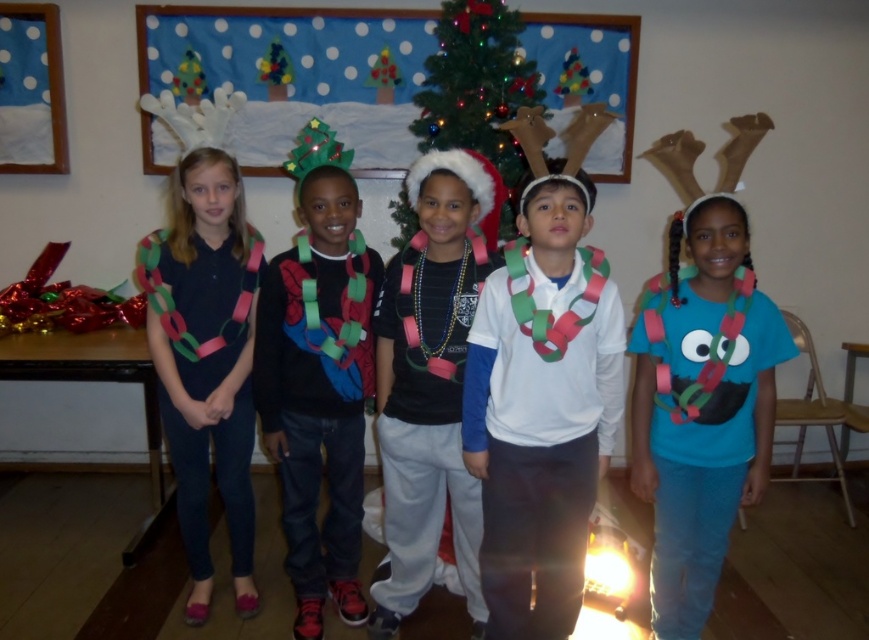
Where is `matte paper chain at center`? matte paper chain at center is located at coordinates (317, 378).

Who is positioned more to the right, matte paper chain at center or green paper chain at center?

green paper chain at center is more to the right.

Which is behind, point (312, 621) or point (527, 72)?

Positioned behind is point (527, 72).

Locate an element on the screen. matte paper chain at center is located at coordinates (317, 378).

Is matte paper chain at center positioned behind matte paper chain at left?

No.

Looking at this image, can you confirm if matte paper chain at center is positioned to the right of matte paper chain at left?

Indeed, matte paper chain at center is positioned on the right side of matte paper chain at left.

You are a GUI agent. You are given a task and a screenshot of the screen. Output one action in this format:
    pyautogui.click(x=<x>, y=<y>)
    Task: Click on the matte paper chain at center
    
    Given the screenshot: What is the action you would take?
    pyautogui.click(x=317, y=378)

Can you confirm if matte black shirt at center is taller than matte paper chain at left?

In fact, matte black shirt at center may be shorter than matte paper chain at left.

Who is more forward, (442, 390) or (178, 493)?

Point (442, 390) is more forward.

This screenshot has width=869, height=640. I want to click on matte black shirt at center, so click(430, 381).